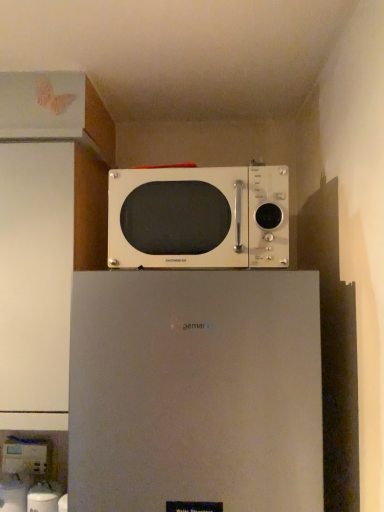
Question: Does white plastic water dispenser at lower left, which appears as the first appliance when viewed from the top, lie in front of satin white refrigerator at upper center?

Choices:
 (A) yes
 (B) no

Answer: (B)

Question: Can you confirm if white plastic water dispenser at lower left, the second appliance positioned from the front, is wider than satin white refrigerator at upper center?

Choices:
 (A) no
 (B) yes

Answer: (A)

Question: From a real-world perspective, is white plastic water dispenser at lower left, acting as the first appliance starting from the left, below satin white refrigerator at upper center?

Choices:
 (A) yes
 (B) no

Answer: (A)

Question: Is white plastic water dispenser at lower left, acting as the first appliance starting from the left, smaller than satin white refrigerator at upper center?

Choices:
 (A) yes
 (B) no

Answer: (A)

Question: Is satin white refrigerator at upper center at the back of white plastic water dispenser at lower left, which appears as the first appliance when viewed from the top?

Choices:
 (A) yes
 (B) no

Answer: (B)

Question: From a real-world perspective, is white plastic water dispenser at lower left, the second appliance positioned from the front, located higher than satin white refrigerator at upper center?

Choices:
 (A) yes
 (B) no

Answer: (B)

Question: Considering the relative sizes of white glossy water dispenser at lower left, the first appliance positioned from the bottom, and white glossy microwave at upper center in the image provided, is white glossy water dispenser at lower left, the first appliance positioned from the bottom, wider than white glossy microwave at upper center?

Choices:
 (A) yes
 (B) no

Answer: (B)

Question: From a real-world perspective, is white glossy water dispenser at lower left, which appears as the 2th appliance when viewed from the back, over white glossy microwave at upper center?

Choices:
 (A) no
 (B) yes

Answer: (A)

Question: From the image's perspective, is white glossy water dispenser at lower left, the 1th appliance positioned from the front, below white glossy microwave at upper center?

Choices:
 (A) yes
 (B) no

Answer: (A)

Question: From the image's perspective, is white glossy water dispenser at lower left, acting as the 1th appliance starting from the right, over white glossy microwave at upper center?

Choices:
 (A) yes
 (B) no

Answer: (B)

Question: Does white glossy water dispenser at lower left, the second appliance in the top-to-bottom sequence, have a smaller size compared to white glossy microwave at upper center?

Choices:
 (A) yes
 (B) no

Answer: (A)

Question: Considering the relative positions of white glossy water dispenser at lower left, acting as the 1th appliance starting from the right, and white glossy microwave at upper center in the image provided, is white glossy water dispenser at lower left, acting as the 1th appliance starting from the right, in front of white glossy microwave at upper center?

Choices:
 (A) yes
 (B) no

Answer: (B)

Question: Does satin white refrigerator at upper center come in front of white glossy water dispenser at lower left, the 1th appliance positioned from the front?

Choices:
 (A) no
 (B) yes

Answer: (B)